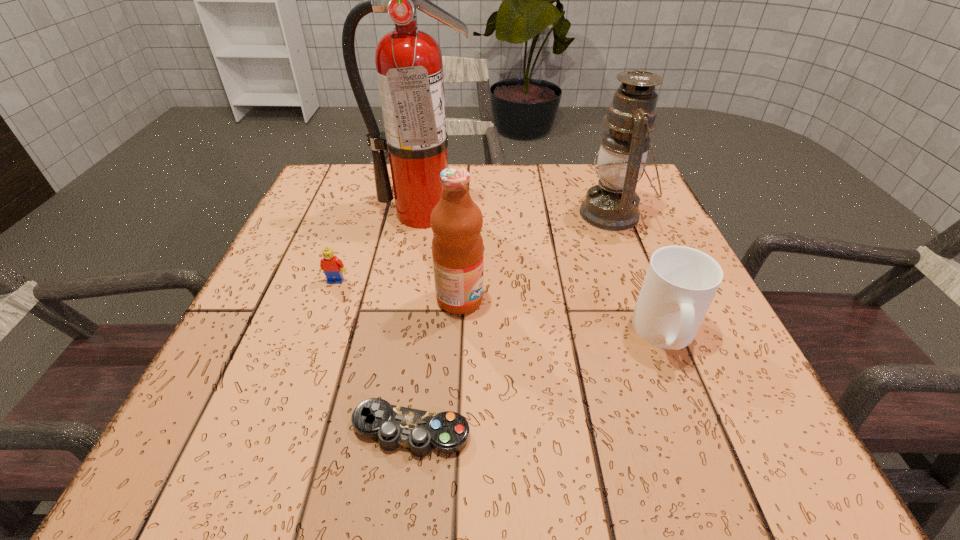
You are a GUI agent. You are given a task and a screenshot of the screen. Output one action in this format:
    pyautogui.click(x=<x>, y=<y>)
    Task: Click on the unoccupied position between the fruit juice and the leftmost object
    
    Given the screenshot: What is the action you would take?
    pyautogui.click(x=397, y=290)

In order to click on free space between the tallest object and the mug in this screenshot , I will do `click(544, 273)`.

Locate an element on the screen. Image resolution: width=960 pixels, height=540 pixels. free point between the shortest object and the mug is located at coordinates (539, 382).

Where is `free point between the control and the second tallest object`? Image resolution: width=960 pixels, height=540 pixels. free point between the control and the second tallest object is located at coordinates (512, 322).

The width and height of the screenshot is (960, 540). In order to click on vacant space that is in between the fruit juice and the leftmost object in this screenshot , I will do `click(397, 290)`.

Where is `vacant region between the fruit juice and the oil lamp`? This screenshot has width=960, height=540. vacant region between the fruit juice and the oil lamp is located at coordinates (537, 256).

Locate an element on the screen. object that is the second nearest to the tallest object is located at coordinates (457, 245).

You are a GUI agent. You are given a task and a screenshot of the screen. Output one action in this format:
    pyautogui.click(x=<x>, y=<y>)
    Task: Click on the object that is the fifth closest to the fruit juice
    The image size is (960, 540).
    Given the screenshot: What is the action you would take?
    pyautogui.click(x=612, y=204)

Identify the location of vacant area in the image that satisfies the following two spatial constraints: 1. on the nozzle side of the tallest object; 2. on the left side of the second tallest object. Image resolution: width=960 pixels, height=540 pixels. (422, 214).

This screenshot has width=960, height=540. What are the coordinates of `free location that satisfies the following two spatial constraints: 1. on the face of the leftmost object; 2. on the right side of the shortest object` in the screenshot? It's located at (282, 430).